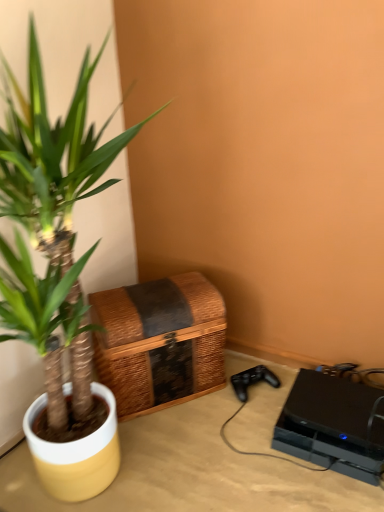
Question: From a real-world perspective, is beige wood table at lower right located beneath green leafy plant at left?

Choices:
 (A) no
 (B) yes

Answer: (B)

Question: From a real-world perspective, is beige wood table at lower right physically above green leafy plant at left?

Choices:
 (A) yes
 (B) no

Answer: (B)

Question: From the image's perspective, does beige wood table at lower right appear lower than green leafy plant at left?

Choices:
 (A) yes
 (B) no

Answer: (A)

Question: Considering the relative sizes of beige wood table at lower right and green leafy plant at left in the image provided, is beige wood table at lower right bigger than green leafy plant at left?

Choices:
 (A) yes
 (B) no

Answer: (B)

Question: Does beige wood table at lower right have a lesser width compared to green leafy plant at left?

Choices:
 (A) no
 (B) yes

Answer: (A)

Question: Which is correct: woven brown basket at lower left is inside beige wood table at lower right, or outside of it?

Choices:
 (A) outside
 (B) inside

Answer: (A)

Question: From a real-world perspective, relative to beige wood table at lower right, is woven brown basket at lower left vertically above or below?

Choices:
 (A) below
 (B) above

Answer: (B)

Question: Based on their positions, is woven brown basket at lower left located to the left or right of beige wood table at lower right?

Choices:
 (A) left
 (B) right

Answer: (A)

Question: Considering the positions of point pos(140,387) and point pos(218,480), is point pos(140,387) closer or farther from the camera than point pos(218,480)?

Choices:
 (A) farther
 (B) closer

Answer: (A)

Question: Is green leafy plant at left taller or shorter than black matte gaming console at lower right?

Choices:
 (A) tall
 (B) short

Answer: (A)

Question: Is green leafy plant at left bigger or smaller than black matte gaming console at lower right?

Choices:
 (A) big
 (B) small

Answer: (A)

Question: Would you say green leafy plant at left is to the left or to the right of black matte gaming console at lower right in the picture?

Choices:
 (A) right
 (B) left

Answer: (B)

Question: Considering their positions, is green leafy plant at left located in front of or behind black matte gaming console at lower right?

Choices:
 (A) behind
 (B) front

Answer: (B)

Question: Is point (162, 374) closer or farther from the camera than point (97, 326)?

Choices:
 (A) farther
 (B) closer

Answer: (A)

Question: Considering their positions, is woven brown basket at lower left located in front of or behind green leafy plant at left?

Choices:
 (A) front
 (B) behind

Answer: (B)